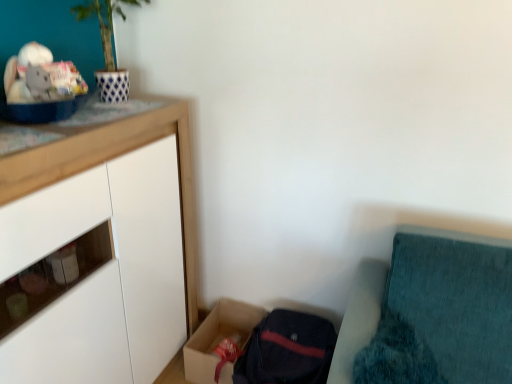
Question: Looking at the image, does white matte cabinet at upper left seem bigger or smaller compared to cardboard box at lower center?

Choices:
 (A) small
 (B) big

Answer: (B)

Question: From the image's perspective, relative to cardboard box at lower center, is white matte cabinet at upper left above or below?

Choices:
 (A) below
 (B) above

Answer: (B)

Question: Based on their relative distances, which object is farther from the cardboard box at lower center?

Choices:
 (A) white matte cabinet at upper left
 (B) teal fabric cushion at lower right

Answer: (B)

Question: Estimate the real-world distances between objects in this image. Which object is closer to the teal fabric cushion at lower right?

Choices:
 (A) cardboard box at lower center
 (B) white matte cabinet at upper left

Answer: (A)